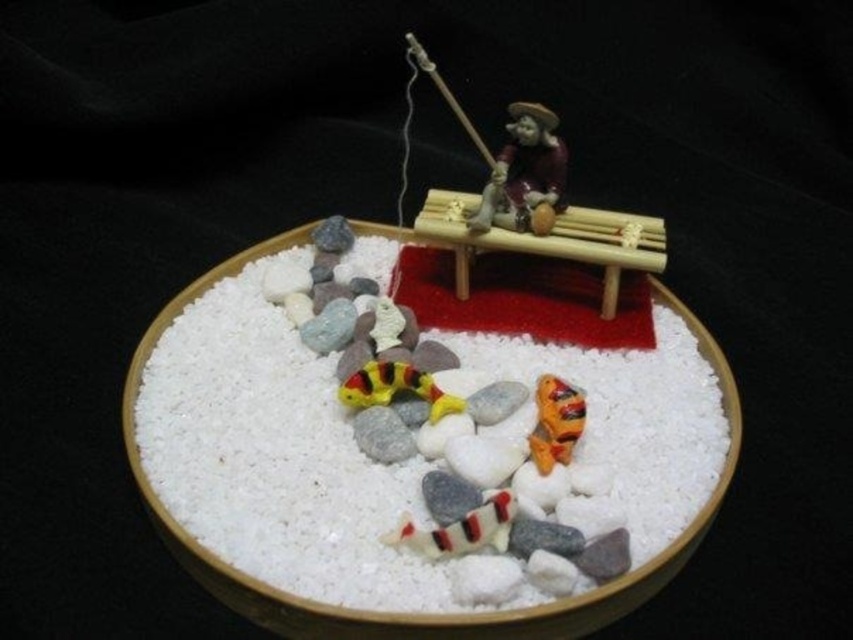
Question: Is striped rubber snake at center further to camera compared to yellow rubber fish at center?

Choices:
 (A) no
 (B) yes

Answer: (A)

Question: Is white sand at center closer to the viewer compared to orange rubber fish at lower center?

Choices:
 (A) yes
 (B) no

Answer: (A)

Question: Which point is farther to the camera?

Choices:
 (A) [386, 369]
 (B) [723, 387]
 (C) [462, 109]

Answer: (C)

Question: Estimate the real-world distances between objects in this image. Which object is closer to the yellow rubber fish at center?

Choices:
 (A) orange rubber fish at lower center
 (B) matte brown wooden boat at upper center
 (C) matte brown figurine at center
 (D) white sand at center

Answer: (A)

Question: Which point is closer to the camera taking this photo?

Choices:
 (A) (178, 528)
 (B) (430, 532)
 (C) (469, 221)

Answer: (B)

Question: Is striped rubber snake at center thinner than orange rubber fish at lower center?

Choices:
 (A) yes
 (B) no

Answer: (B)